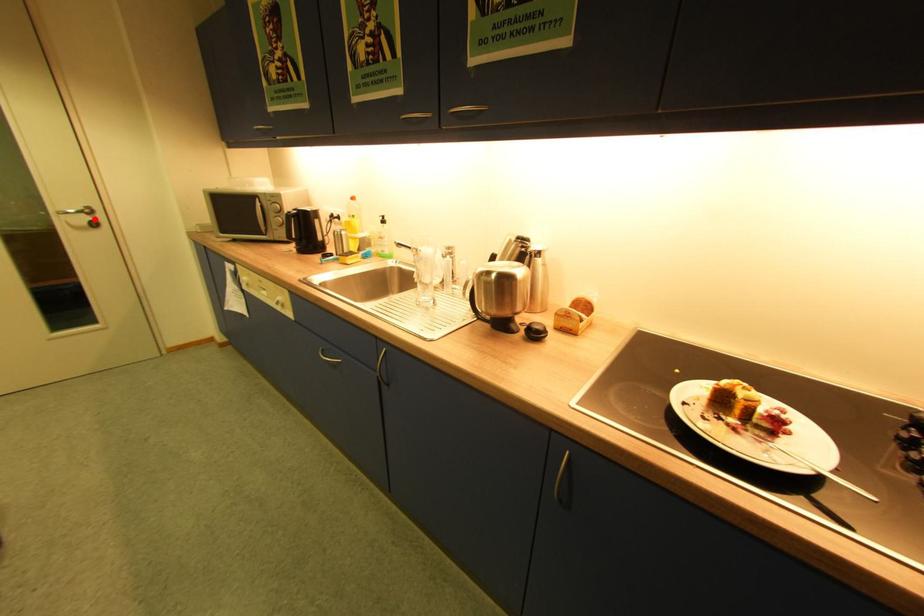
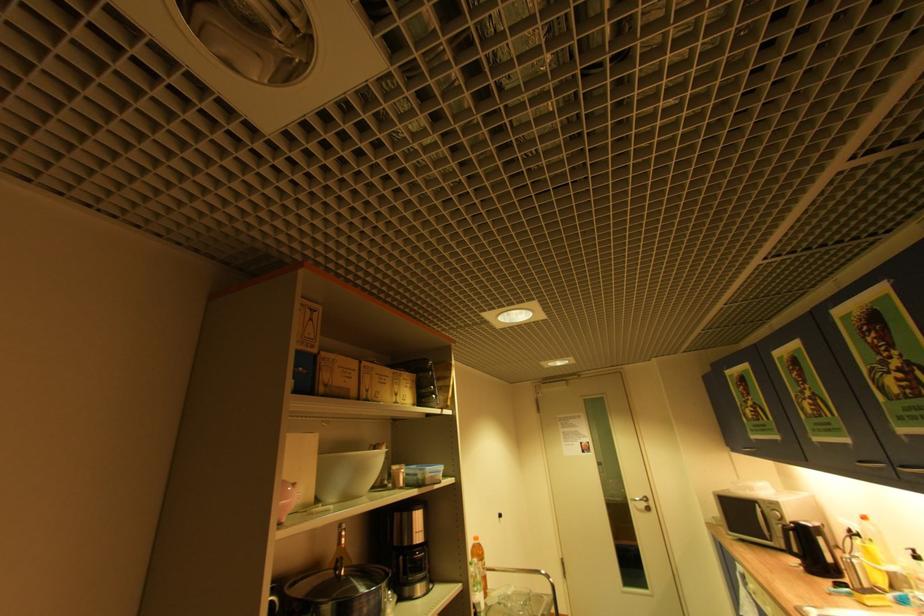
Find the pixel in the second image that matches the highlighted location in the first image.

(650, 505)